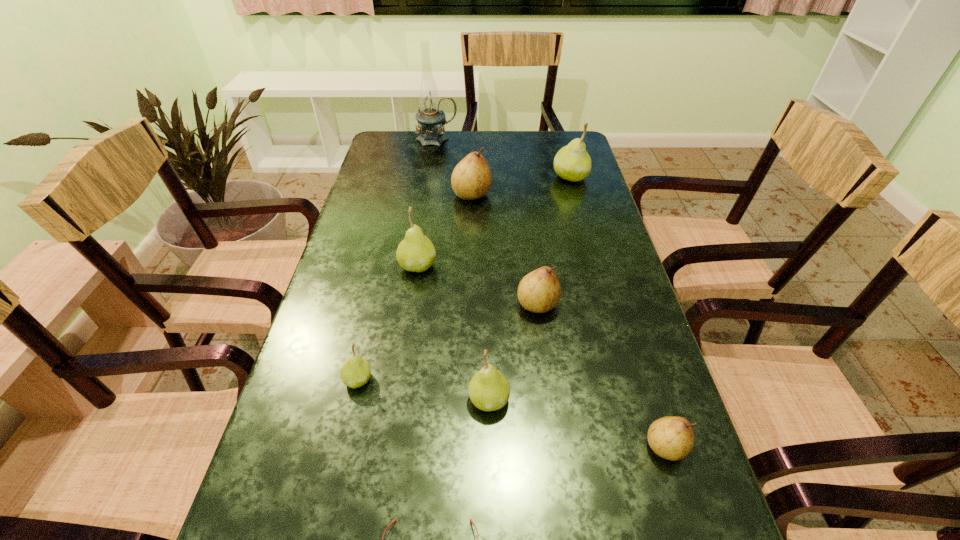
Where is `vacant space situated on the right of the second green pear from right to left`? vacant space situated on the right of the second green pear from right to left is located at coordinates (623, 399).

Find the location of a particular element. Image resolution: width=960 pixels, height=540 pixels. vacant space located on the back of the rightmost brown pear is located at coordinates click(x=623, y=310).

Identify the location of free space located on the right of the leftmost pear. The height and width of the screenshot is (540, 960). (521, 380).

Where is `object that is at the far edge`? This screenshot has width=960, height=540. object that is at the far edge is located at coordinates (430, 119).

I want to click on oil lamp at the left edge, so click(x=430, y=119).

At what (x,y) coordinates should I click in order to perform the action: click on object situated at the far left corner. Please return your answer as a coordinate pair (x, y). This screenshot has height=540, width=960. Looking at the image, I should click on (430, 119).

Where is `vacant point at the far edge`? This screenshot has width=960, height=540. vacant point at the far edge is located at coordinates (427, 148).

I want to click on vacant space at the left edge of the desktop, so click(x=383, y=199).

Locate an element on the screen. vacant space at the right edge of the desktop is located at coordinates (586, 356).

Locate an element on the screen. The width and height of the screenshot is (960, 540). unoccupied position between the second pear from left to right and the second smallest green pear is located at coordinates [x=453, y=332].